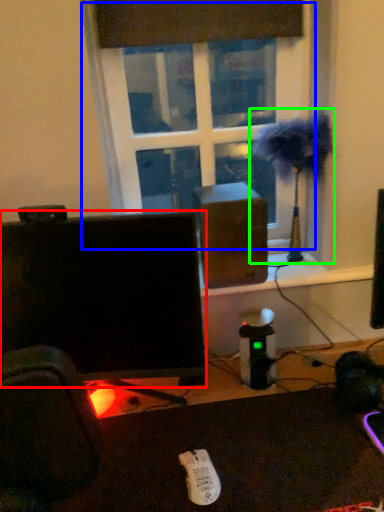
Question: Estimate the real-world distances between objects in this image. Which object is closer to computer monitor (highlighted by a red box), window (highlighted by a blue box) or table lamp (highlighted by a green box)?

Choices:
 (A) window
 (B) table lamp

Answer: (A)